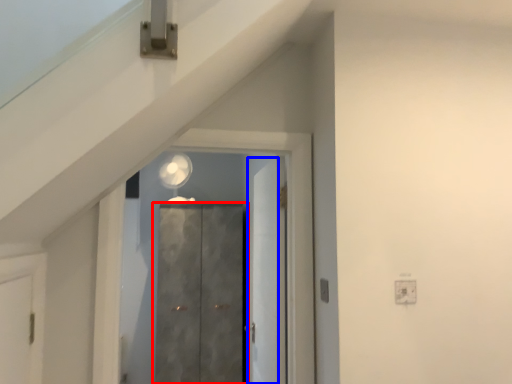
Question: Which object is further to the camera taking this photo, door (highlighted by a red box) or door (highlighted by a blue box)?

Choices:
 (A) door
 (B) door

Answer: (A)